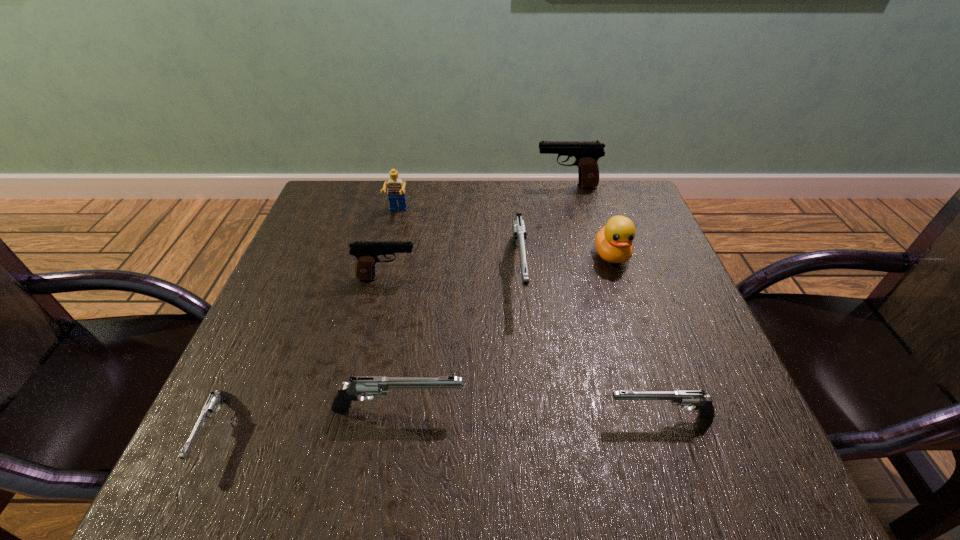
Where is `vacant space in between the yellow duckling and the second farthest object`? vacant space in between the yellow duckling and the second farthest object is located at coordinates (505, 234).

Identify the location of free space between the seventh nearest object and the second biggest silver pistol. The width and height of the screenshot is (960, 540). (398, 310).

Where is `free space between the seventh tallest object and the smaller black pistol`? This screenshot has height=540, width=960. free space between the seventh tallest object and the smaller black pistol is located at coordinates (523, 347).

Identify the location of free space between the shortest pistol and the fifth tallest pistol. coord(437,423).

Locate an element on the screen. The height and width of the screenshot is (540, 960). blank region between the fourth tallest pistol and the duckling is located at coordinates (505, 332).

Where is `unoccupied area between the second shortest object and the Lego`? unoccupied area between the second shortest object and the Lego is located at coordinates (529, 314).

The image size is (960, 540). What are the coordinates of `free spot between the nearer black pistol and the farthest pistol` in the screenshot? It's located at (477, 232).

Where is `empty space between the second biggest silver pistol and the blue Lego`? The width and height of the screenshot is (960, 540). empty space between the second biggest silver pistol and the blue Lego is located at coordinates (398, 310).

Find the location of a particular element. The height and width of the screenshot is (540, 960). vacant space that's between the shortest pistol and the Lego is located at coordinates coord(306,321).

You are a GUI agent. You are given a task and a screenshot of the screen. Output one action in this format:
    pyautogui.click(x=<x>, y=<y>)
    Task: Click on the empty space that is in between the second farthest object and the sixth tallest object
    The width and height of the screenshot is (960, 540).
    Given the screenshot: What is the action you would take?
    pyautogui.click(x=398, y=310)